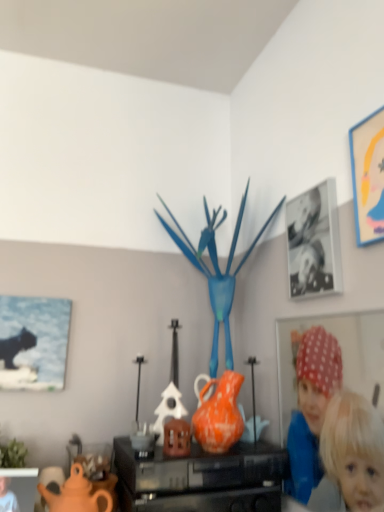
Question: Is matte black cat at left, the fourth picture frame in the right-to-left sequence, at the back of matte orange teapot at lower left?

Choices:
 (A) yes
 (B) no

Answer: (B)

Question: Does matte orange teapot at lower left have a lesser height compared to matte black cat at left, the fourth picture frame in the right-to-left sequence?

Choices:
 (A) yes
 (B) no

Answer: (A)

Question: Does matte orange teapot at lower left come in front of matte black cat at left, the fourth picture frame in the right-to-left sequence?

Choices:
 (A) yes
 (B) no

Answer: (A)

Question: Is matte orange teapot at lower left oriented towards matte black cat at left, arranged as the 3th picture frame when viewed from the top?

Choices:
 (A) no
 (B) yes

Answer: (A)

Question: Can you confirm if matte orange teapot at lower left is taller than matte black cat at left, the fourth picture frame in the right-to-left sequence?

Choices:
 (A) no
 (B) yes

Answer: (A)

Question: Does matte orange teapot at lower left appear on the left side of matte black cat at left, arranged as the 3th picture frame when viewed from the top?

Choices:
 (A) yes
 (B) no

Answer: (B)

Question: Does matte yellow picture frame at upper right, which ranks as the 1th picture frame in right-to-left order, have a smaller size compared to matte orange vase at center?

Choices:
 (A) no
 (B) yes

Answer: (B)

Question: Can you confirm if matte yellow picture frame at upper right, the first picture frame when ordered from top to bottom, is shorter than matte orange vase at center?

Choices:
 (A) yes
 (B) no

Answer: (B)

Question: Is matte yellow picture frame at upper right, the first picture frame when ordered from top to bottom, surrounding matte orange vase at center?

Choices:
 (A) yes
 (B) no

Answer: (B)

Question: Is matte yellow picture frame at upper right, which ranks as the 1th picture frame in right-to-left order, thinner than matte orange vase at center?

Choices:
 (A) yes
 (B) no

Answer: (A)

Question: Is matte yellow picture frame at upper right, which ranks as the 1th picture frame in right-to-left order, positioned in front of matte orange vase at center?

Choices:
 (A) no
 (B) yes

Answer: (B)

Question: Is matte yellow picture frame at upper right, acting as the 4th picture frame starting from the bottom, completely or partially outside of matte orange vase at center?

Choices:
 (A) yes
 (B) no

Answer: (A)

Question: Is matte black picture frame at lower left, which appears as the third picture frame when viewed from the right, taller than orange matte vase at center?

Choices:
 (A) yes
 (B) no

Answer: (B)